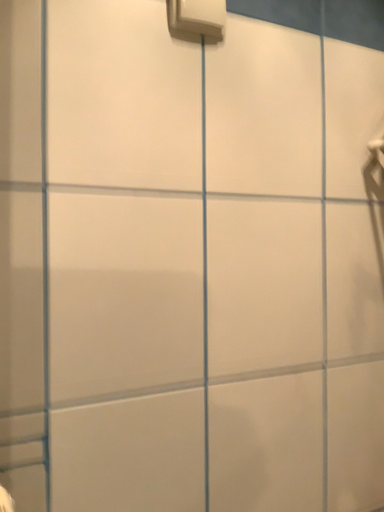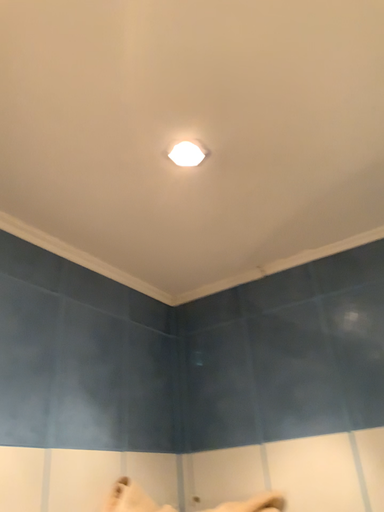
Question: How did the camera likely rotate when shooting the video?

Choices:
 (A) rotated right
 (B) rotated left

Answer: (A)